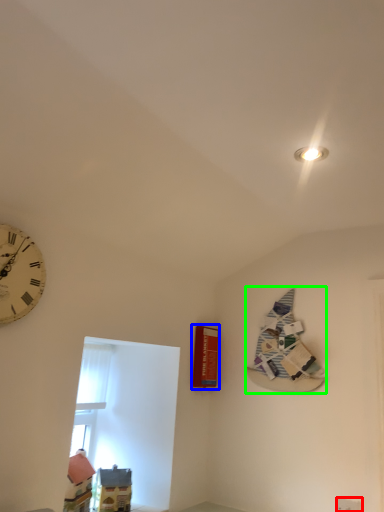
Question: Which object is positioned farthest from electric outlet (highlighted by a red box)? Select from magazine (highlighted by a blue box) and book (highlighted by a green box).

Choices:
 (A) magazine
 (B) book

Answer: (A)